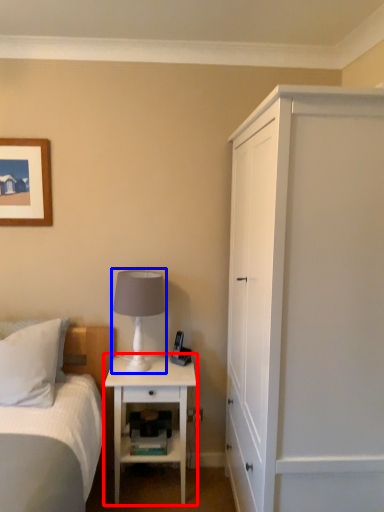
Question: Among these objects, which one is nearest to the camera, nightstand (highlighted by a red box) or table lamp (highlighted by a blue box)?

Choices:
 (A) nightstand
 (B) table lamp

Answer: (B)